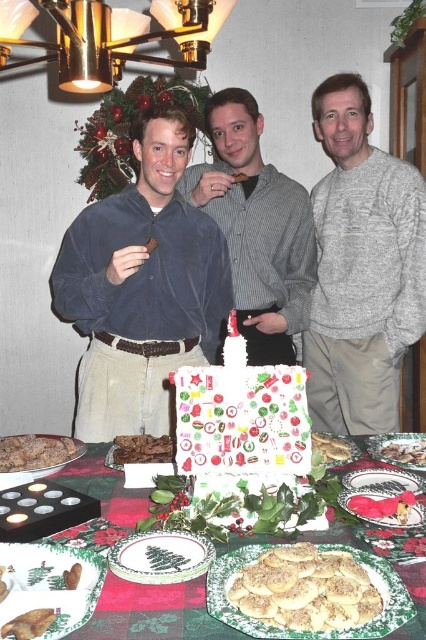
What do you see at coordinates (161, 556) in the screenshot? This screenshot has height=640, width=426. I see `green matte platter at center` at bounding box center [161, 556].

Who is lower down, green matte platter at center or crumbly brown cookie at center?

green matte platter at center is lower down.

Which is behind, point (187, 564) or point (351, 460)?

The point (351, 460) is more distant.

Identify the location of green matte platter at center. (161, 556).

In the scene shown: Can you confirm if smooth chocolate bar at center is wider than slightly toasted bread at center?

Incorrect, smooth chocolate bar at center's width does not surpass slightly toasted bread at center's.

Describe the element at coordinates (382, 506) in the screenshot. The width and height of the screenshot is (426, 640). I see `smooth chocolate bar at center` at that location.

This screenshot has width=426, height=640. Identify the location of smooth chocolate bar at center. (382, 506).

Who is positioned more to the left, matte blue sweater at center or brown crumbly cookie at lower left?

Positioned to the left is brown crumbly cookie at lower left.

Can you confirm if matte blue sweater at center is shorter than brown crumbly cookie at lower left?

Incorrect, matte blue sweater at center's height does not fall short of brown crumbly cookie at lower left's.

Where is `matte blue sweater at center`? This screenshot has height=640, width=426. matte blue sweater at center is located at coordinates (129, 129).

This screenshot has width=426, height=640. I want to click on matte blue sweater at center, so click(x=129, y=129).